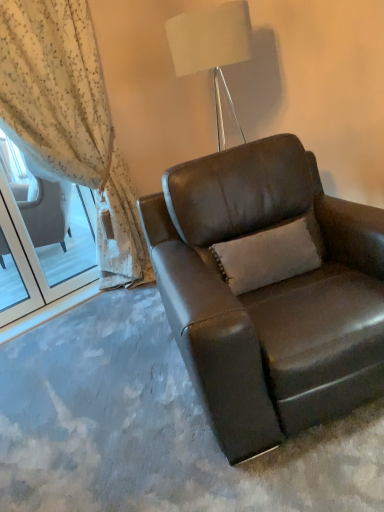
What do you see at coordinates (270, 254) in the screenshot? I see `beige fabric pillow at center` at bounding box center [270, 254].

Where is `sheer floral fabric at left`? This screenshot has width=384, height=512. sheer floral fabric at left is located at coordinates coord(70,120).

This screenshot has height=512, width=384. I want to click on white fabric lampshade at upper center, so click(x=211, y=47).

This screenshot has height=512, width=384. What are the coordinates of `brown leather chair at center` in the screenshot? It's located at (268, 290).

How far apart are sheer floral fabric at left and white fabric lampshade at upper center?

sheer floral fabric at left is 92.05 centimeters away from white fabric lampshade at upper center.

Considering the sizes of objects sheer floral fabric at left and white fabric lampshade at upper center in the image provided, who is wider, sheer floral fabric at left or white fabric lampshade at upper center?

white fabric lampshade at upper center is wider.

Is sheer floral fabric at left positioned beyond the bounds of white fabric lampshade at upper center?

Absolutely, sheer floral fabric at left is external to white fabric lampshade at upper center.

In the scene shown: From the image's perspective, is sheer floral fabric at left on top of white fabric lampshade at upper center?

Incorrect, from the image's perspective, sheer floral fabric at left is lower than white fabric lampshade at upper center.

From the image's perspective, does white fabric lampshade at upper center appear lower than brown leather chair at center?

Actually, white fabric lampshade at upper center appears above brown leather chair at center in the image.

In the scene shown: Considering the sizes of white fabric lampshade at upper center and brown leather chair at center in the image, is white fabric lampshade at upper center wider or thinner than brown leather chair at center?

white fabric lampshade at upper center is thinner than brown leather chair at center.

Which is behind, white fabric lampshade at upper center or brown leather chair at center?

Positioned behind is white fabric lampshade at upper center.

From a real-world perspective, is white fabric lampshade at upper center located beneath brown leather chair at center?

Incorrect, from a real-world perspective, white fabric lampshade at upper center is higher than brown leather chair at center.

Does point (274, 366) come in front of point (33, 114)?

Yes.

Is brown leather chair at center oriented away from sheer floral fabric at left?

Yes, brown leather chair at center is positioned with its back facing sheer floral fabric at left.

From the image's perspective, which is below, brown leather chair at center or sheer floral fabric at left?

brown leather chair at center, from the image's perspective.

Does brown leather chair at center have a greater width compared to sheer floral fabric at left?

Yes, brown leather chair at center is wider than sheer floral fabric at left.

Would you say brown leather chair at center is a long distance from white fabric lampshade at upper center?

That's not correct — brown leather chair at center is a little close to white fabric lampshade at upper center.

Is brown leather chair at center thinner than white fabric lampshade at upper center?

Incorrect, the width of brown leather chair at center is not less than that of white fabric lampshade at upper center.

Image resolution: width=384 pixels, height=512 pixels. Find the location of `chair that appears below the white fabric lampshade at upper center (from a real-world perspective)`. chair that appears below the white fabric lampshade at upper center (from a real-world perspective) is located at coordinates (268, 290).

Measure the distance from beige fabric pillow at center to white fabric lampshade at upper center.

beige fabric pillow at center and white fabric lampshade at upper center are 36.46 inches apart from each other.

Does beige fabric pillow at center have a smaller size compared to white fabric lampshade at upper center?

Correct, beige fabric pillow at center occupies less space than white fabric lampshade at upper center.

Between beige fabric pillow at center and white fabric lampshade at upper center, which one has less height?

With less height is beige fabric pillow at center.

From a real-world perspective, is beige fabric pillow at center on white fabric lampshade at upper center?

Incorrect, from a real-world perspective, beige fabric pillow at center is lower than white fabric lampshade at upper center.

Considering the relative positions of sheer floral fabric at left and brown leather chair at center in the image provided, is sheer floral fabric at left in front of brown leather chair at center?

No, sheer floral fabric at left is further to the viewer.

Considering the positions of point (17, 30) and point (311, 177), is point (17, 30) closer or farther from the camera than point (311, 177)?

Point (17, 30).

Locate an element on the screen. This screenshot has width=384, height=512. curtain above the brown leather chair at center (from the image's perspective) is located at coordinates (70, 120).

Is sheer floral fabric at left not close to beige fabric pillow at center?

Yes, sheer floral fabric at left and beige fabric pillow at center are quite far apart.

Based on the photo, how different are the orientations of sheer floral fabric at left and beige fabric pillow at center in degrees?

21.6 degrees separate the facing orientations of sheer floral fabric at left and beige fabric pillow at center.

Who is bigger, sheer floral fabric at left or beige fabric pillow at center?

With larger size is sheer floral fabric at left.

Is sheer floral fabric at left inside the boundaries of beige fabric pillow at center, or outside?

sheer floral fabric at left cannot be found inside beige fabric pillow at center.

The image size is (384, 512). Identify the location of lamp located above the sheer floral fabric at left (from the image's perspective). (211, 47).

The image size is (384, 512). In order to click on chair below the white fabric lampshade at upper center (from the image's perspective) in this screenshot , I will do `click(268, 290)`.

Looking at the image, which one is located closer to brown leather chair at center, sheer floral fabric at left or beige fabric pillow at center?

beige fabric pillow at center is positioned closer to the anchor brown leather chair at center.

Based on the photo, which object lies further to the anchor point sheer floral fabric at left, beige fabric pillow at center or white fabric lampshade at upper center?

The object further to sheer floral fabric at left is beige fabric pillow at center.

When comparing their distances from white fabric lampshade at upper center, does beige fabric pillow at center or brown leather chair at center seem further?

brown leather chair at center is positioned further to the anchor white fabric lampshade at upper center.

Based on their spatial positions, is brown leather chair at center or sheer floral fabric at left further from white fabric lampshade at upper center?

Based on the image, brown leather chair at center appears to be further to white fabric lampshade at upper center.

Looking at the image, which one is located further to brown leather chair at center, beige fabric pillow at center or sheer floral fabric at left?

The object further to brown leather chair at center is sheer floral fabric at left.

Estimate the real-world distances between objects in this image. Which object is closer to beige fabric pillow at center, brown leather chair at center or sheer floral fabric at left?

Among the two, brown leather chair at center is located nearer to beige fabric pillow at center.

Considering their positions, is sheer floral fabric at left positioned further to white fabric lampshade at upper center than beige fabric pillow at center?

Based on the image, beige fabric pillow at center appears to be further to white fabric lampshade at upper center.

From the image, which object appears to be nearer to brown leather chair at center, sheer floral fabric at left or white fabric lampshade at upper center?

white fabric lampshade at upper center is closer to brown leather chair at center.

You are a GUI agent. You are given a task and a screenshot of the screen. Output one action in this format:
    pyautogui.click(x=<x>, y=<y>)
    Task: Click on the pillow between sheer floral fabric at left and brown leather chair at center from left to right
    This screenshot has width=384, height=512.
    Given the screenshot: What is the action you would take?
    pyautogui.click(x=270, y=254)

You are a GUI agent. You are given a task and a screenshot of the screen. Output one action in this format:
    pyautogui.click(x=<x>, y=<y>)
    Task: Click on the pillow between white fabric lampshade at upper center and brown leather chair at center from top to bottom
    
    Given the screenshot: What is the action you would take?
    pyautogui.click(x=270, y=254)

Locate an element on the screen. Image resolution: width=384 pixels, height=512 pixels. lamp between sheer floral fabric at left and brown leather chair at center is located at coordinates (211, 47).

What are the coordinates of `lamp between sheer floral fabric at left and beige fabric pillow at center in the horizontal direction` in the screenshot? It's located at (211, 47).